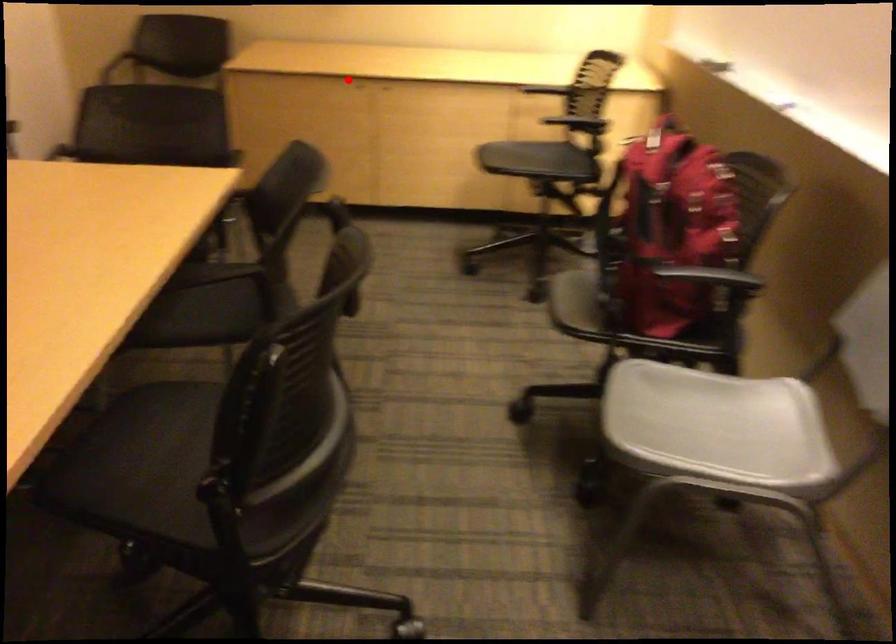
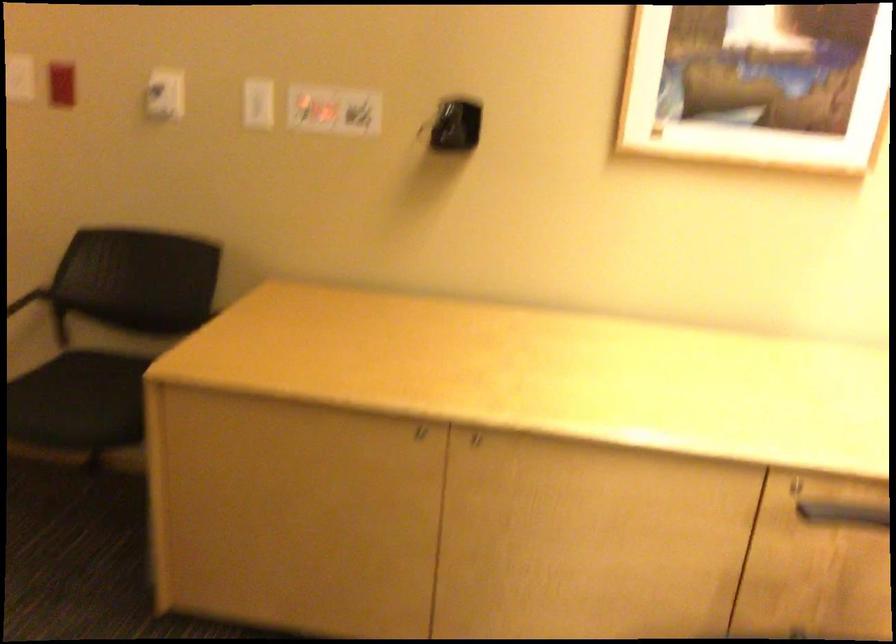
Find the pixel in the second image that matches the highlighted location in the first image.

(410, 433)